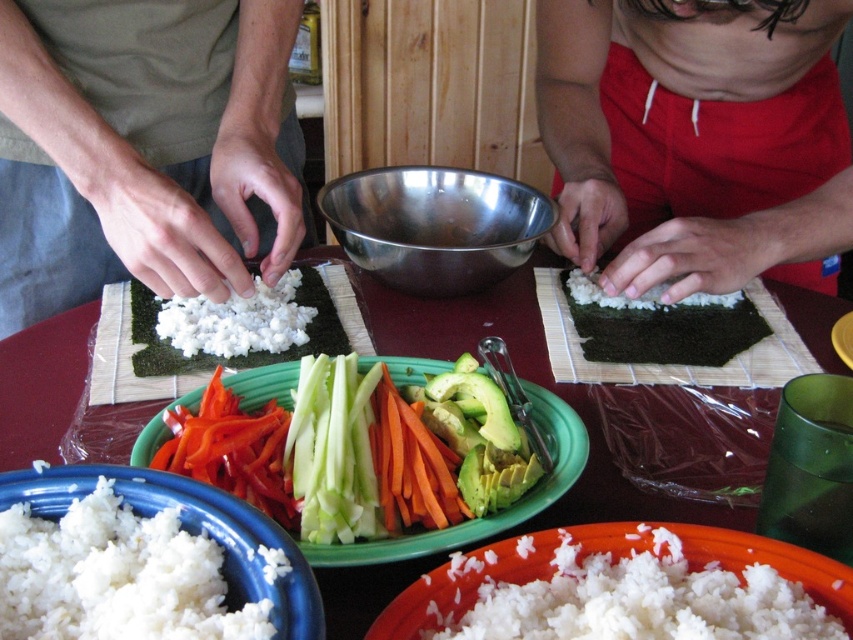
Is matte red shorts at center right taller than marble table at center?

Yes.

Between point (567, 77) and point (523, 333), which one is positioned behind?

Positioned behind is point (567, 77).

Locate an element on the screen. matte red shorts at center right is located at coordinates (695, 140).

Which is more to the left, smooth green platter at center or white fluffy rice at center?

white fluffy rice at center

Who is lower down, smooth green platter at center or white fluffy rice at center?

smooth green platter at center

Image resolution: width=853 pixels, height=640 pixels. What are the coordinates of `smooth green platter at center` in the screenshot? It's located at (489, 515).

From the picture: Can you confirm if white matte rice at lower center is positioned to the left of white matte rice at lower left?

No, white matte rice at lower center is not to the left of white matte rice at lower left.

Does white matte rice at lower center appear on the right side of white matte rice at lower left?

Yes, white matte rice at lower center is to the right of white matte rice at lower left.

What do you see at coordinates (648, 593) in the screenshot? I see `white matte rice at lower center` at bounding box center [648, 593].

Identify the location of white matte rice at lower center. (648, 593).